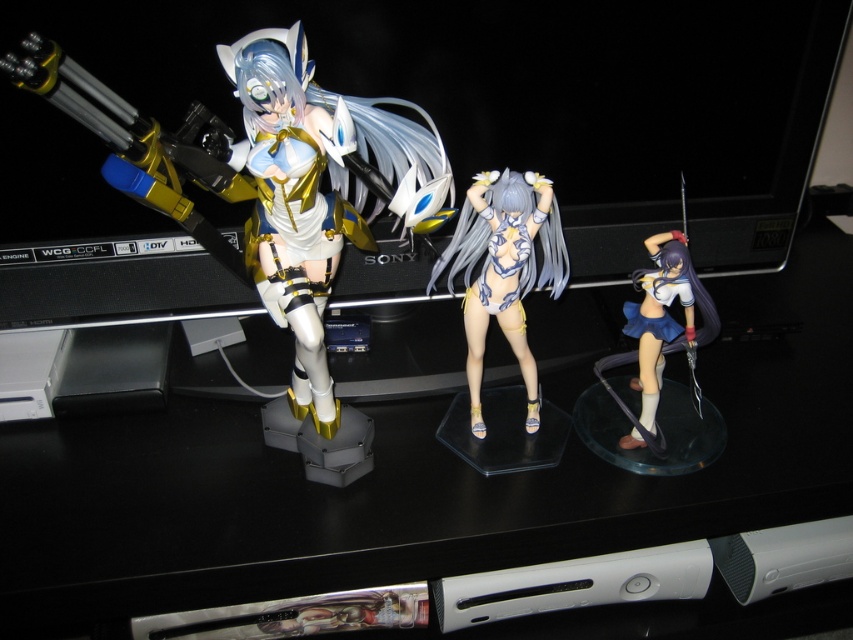
Question: Which of the following is the farthest from the observer?

Choices:
 (A) (498, 320)
 (B) (647, 280)
 (C) (306, 346)
 (D) (76, 616)

Answer: (A)

Question: Which point is closer to the camera taking this photo?

Choices:
 (A) (x=679, y=262)
 (B) (x=154, y=435)
 (C) (x=318, y=195)
 (D) (x=546, y=268)

Answer: (C)

Question: Is black plastic computer desk at center above matte white plastic figure at left?

Choices:
 (A) no
 (B) yes

Answer: (A)

Question: Can you confirm if matte white plastic figure at left is positioned below satin blue skirt at right?

Choices:
 (A) no
 (B) yes

Answer: (A)

Question: Can you confirm if black plastic computer desk at center is wider than satin white bikini at center?

Choices:
 (A) no
 (B) yes

Answer: (B)

Question: Which point is farther to the camera?

Choices:
 (A) satin blue skirt at right
 (B) black plastic computer desk at center
 (C) matte white plastic figure at left

Answer: (A)